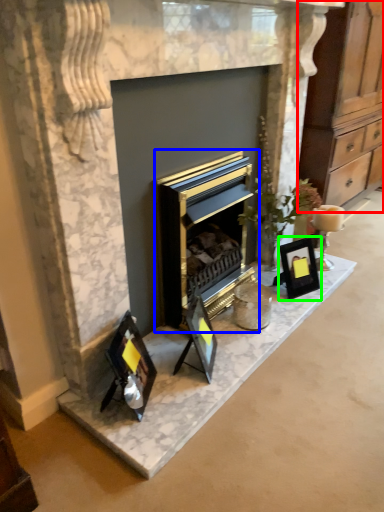
Question: Which object is positioned closest to dresser (highlighted by a red box)? Select from fireplace (highlighted by a blue box) and picture frame (highlighted by a green box).

Choices:
 (A) fireplace
 (B) picture frame

Answer: (B)